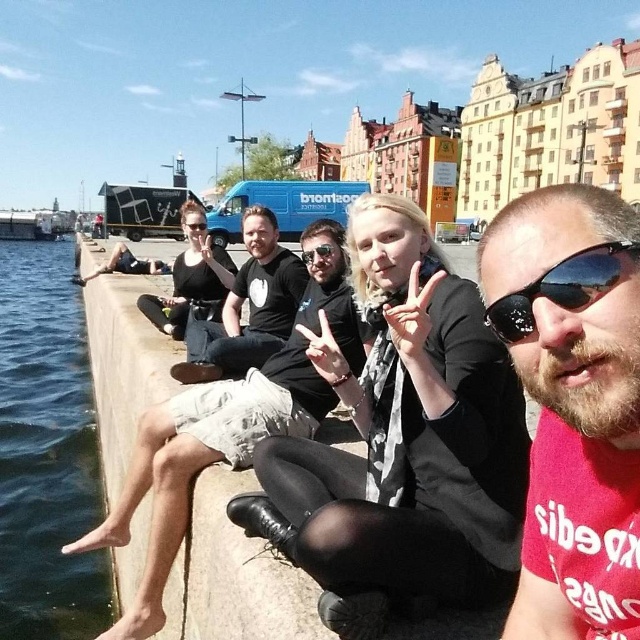
Between light beige shorts at center and black reflective sunglasses at center, which one is positioned higher?

black reflective sunglasses at center

Is light beige shorts at center shorter than black reflective sunglasses at center?

No, light beige shorts at center is not shorter than black reflective sunglasses at center.

Who is more forward, (243, 404) or (560, 269)?

Point (560, 269) is in front.

Identify the location of light beige shorts at center. (221, 438).

Is red matte sunglasses at center below light beige shorts at center?

Actually, red matte sunglasses at center is above light beige shorts at center.

Is red matte sunglasses at center smaller than light beige shorts at center?

Correct, red matte sunglasses at center occupies less space than light beige shorts at center.

Which is in front, point (598, 484) or point (216, 435)?

Point (598, 484) is more forward.

This screenshot has height=640, width=640. I want to click on red matte sunglasses at center, so click(x=573, y=403).

Looking at this image, is red matte sunglasses at center below black reflective sunglasses at center?

Yes.

Where is `red matte sunglasses at center`? This screenshot has height=640, width=640. red matte sunglasses at center is located at coordinates coord(573,403).